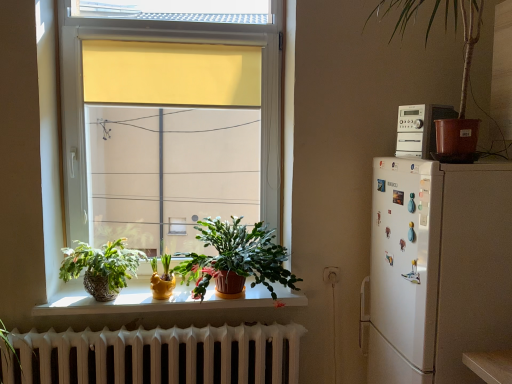
Question: Based on their positions, is green matte plant at center, the third houseplant when ordered from left to right, located to the left or right of textured wicker basket at lower left, arranged as the fourth houseplant when viewed from the right?

Choices:
 (A) left
 (B) right

Answer: (B)

Question: Is green matte plant at center, marked as the 3th houseplant in a bottom-to-top arrangement, taller or shorter than textured wicker basket at lower left, arranged as the 3th houseplant when viewed from the top?

Choices:
 (A) short
 (B) tall

Answer: (B)

Question: Considering the real-world distances, which object is closest to the matte yellow pot at window, the 1th houseplant when ordered from bottom to top?

Choices:
 (A) textured wicker basket at lower left, arranged as the 3th houseplant when viewed from the top
 (B) white matte stereo at upper right
 (C) brown plastic pot at upper right, arranged as the 1th houseplant when viewed from the right
 (D) green matte plant at center, the second houseplant when ordered from right to left

Answer: (A)

Question: Based on their relative distances, which object is farther from the brown plastic pot at upper right, arranged as the 1th houseplant when viewed from the right?

Choices:
 (A) matte yellow pot at window, which ranks as the 2th houseplant in left-to-right order
 (B) white matte stereo at upper right
 (C) green matte plant at center, marked as the 3th houseplant in a bottom-to-top arrangement
 (D) textured wicker basket at lower left, marked as the 2th houseplant in a bottom-to-top arrangement

Answer: (D)